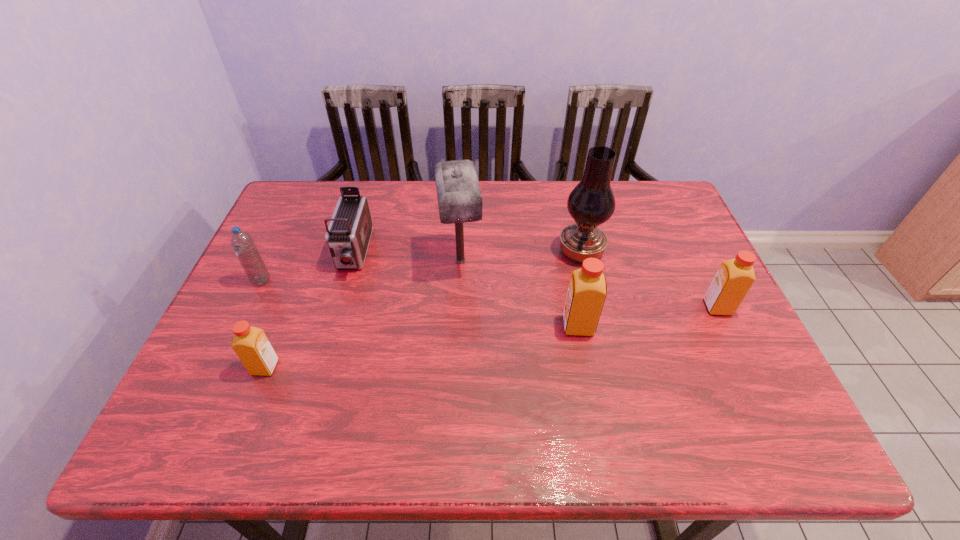
The height and width of the screenshot is (540, 960). Identify the location of free space that satisfies the following two spatial constraints: 1. on the front side of the oil lamp; 2. on the front and back of the shortest orange juice. (608, 367).

I want to click on vacant space that satisfies the following two spatial constraints: 1. at the lens of the camcorder; 2. on the front and back of the nearest orange juice, so click(321, 367).

Image resolution: width=960 pixels, height=540 pixels. I want to click on free location that satisfies the following two spatial constraints: 1. at the lens of the mallet; 2. on the left side of the camcorder, so click(x=351, y=261).

This screenshot has height=540, width=960. I want to click on free space that satisfies the following two spatial constraints: 1. at the lens of the camcorder; 2. on the left side of the mallet, so click(x=351, y=261).

You are a GUI agent. You are given a task and a screenshot of the screen. Output one action in this format:
    pyautogui.click(x=<x>, y=<y>)
    Task: Click on the free space that satisfies the following two spatial constraints: 1. at the lens of the fourth object from right to left; 2. on the right side of the fifth object from right to left
    The height and width of the screenshot is (540, 960).
    Given the screenshot: What is the action you would take?
    pyautogui.click(x=351, y=261)